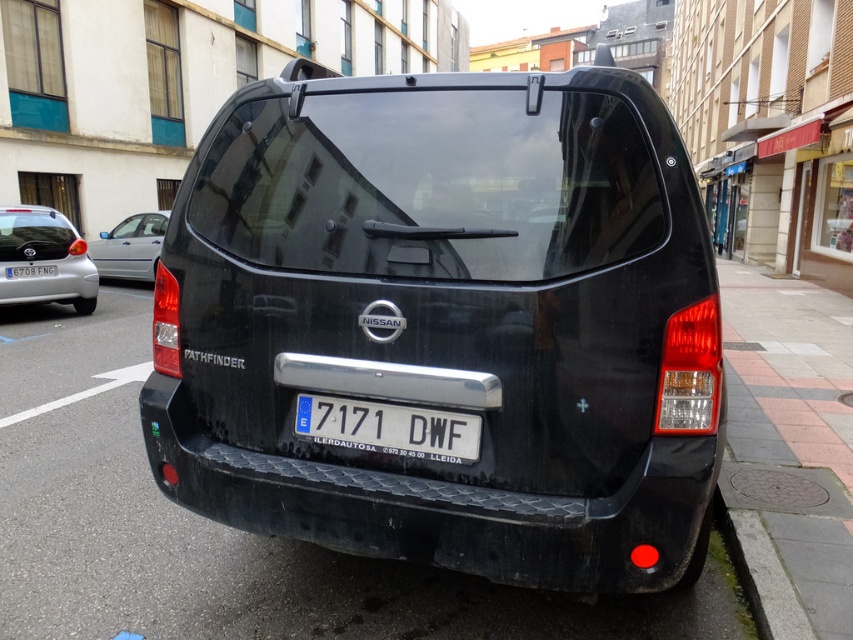
Between rubber textured bumper at center and white plastic license plate at center, which one is positioned higher?

white plastic license plate at center is above.

Does rubber textured bumper at center have a lesser height compared to white plastic license plate at center?

Incorrect, rubber textured bumper at center's height does not fall short of white plastic license plate at center's.

Who is more distant from viewer, (383, 552) or (415, 416)?

Positioned behind is point (383, 552).

I want to click on rubber textured bumper at center, so click(447, 508).

Does black matte minivan at center appear under gray concrete curb at lower right?

No.

Can you confirm if black matte minivan at center is thinner than gray concrete curb at lower right?

No, black matte minivan at center is not thinner than gray concrete curb at lower right.

Who is more forward, (490, 445) or (755, 554)?

Point (490, 445) is more forward.

Identify the location of black matte minivan at center. (447, 323).

Does rubber textured bumper at center appear on the right side of silver metallic hatchback at left?

Correct, you'll find rubber textured bumper at center to the right of silver metallic hatchback at left.

Is point (459, 516) farther from camera compared to point (28, 208)?

No, (459, 516) is closer to viewer.

Find the location of a particular element. The image size is (853, 640). rubber textured bumper at center is located at coordinates (447, 508).